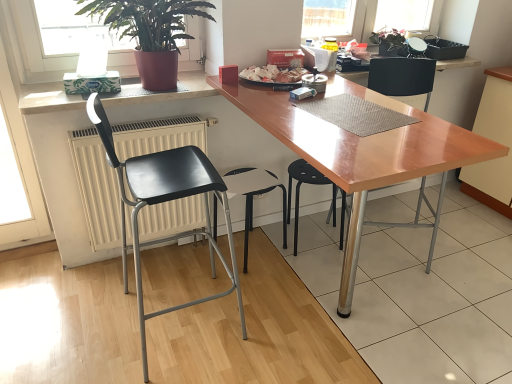
The image size is (512, 384). I want to click on free spot in front of black plastic stool at center, positioned as the 2th chair in left-to-right order, so click(x=269, y=293).